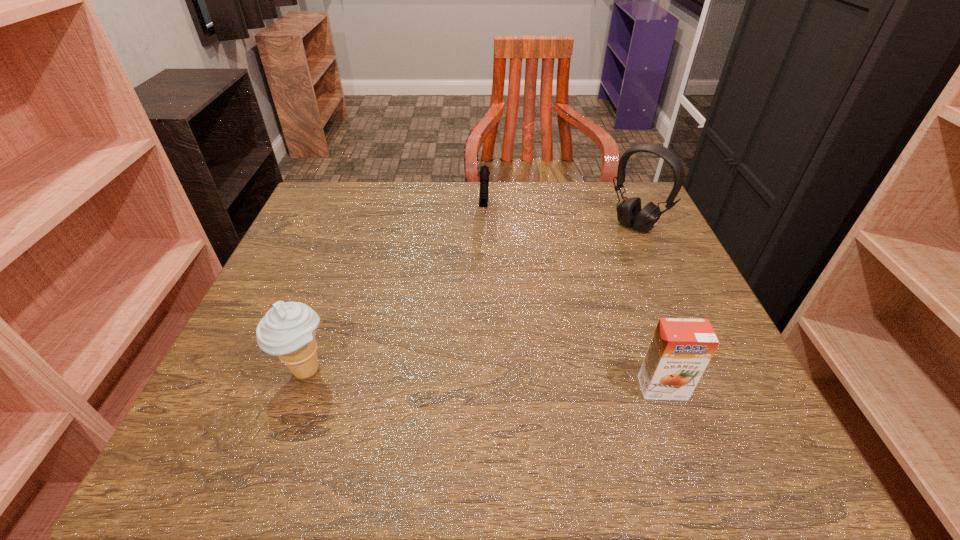
You are a GUI agent. You are given a task and a screenshot of the screen. Output one action in this format:
    pyautogui.click(x=<x>, y=<y>)
    Task: Click on the free spot that satisfies the following two spatial constraints: 1. on the back side of the second object from left to right; 2. on the right side of the icecream
    
    Given the screenshot: What is the action you would take?
    pyautogui.click(x=362, y=212)

The width and height of the screenshot is (960, 540). I want to click on vacant area in the image that satisfies the following two spatial constraints: 1. on the back side of the shortest object; 2. on the left side of the leftmost object, so point(362,212).

The width and height of the screenshot is (960, 540). I want to click on free spot that satisfies the following two spatial constraints: 1. on the back side of the leftmost object; 2. on the left side of the shortest object, so click(x=362, y=212).

Identify the location of free spot that satisfies the following two spatial constraints: 1. on the back side of the leftmost object; 2. on the left side of the headset. (357, 225).

In order to click on vacant point that satisfies the following two spatial constraints: 1. on the back side of the orange juice; 2. on the right side of the headset in this screenshot , I will do `click(604, 225)`.